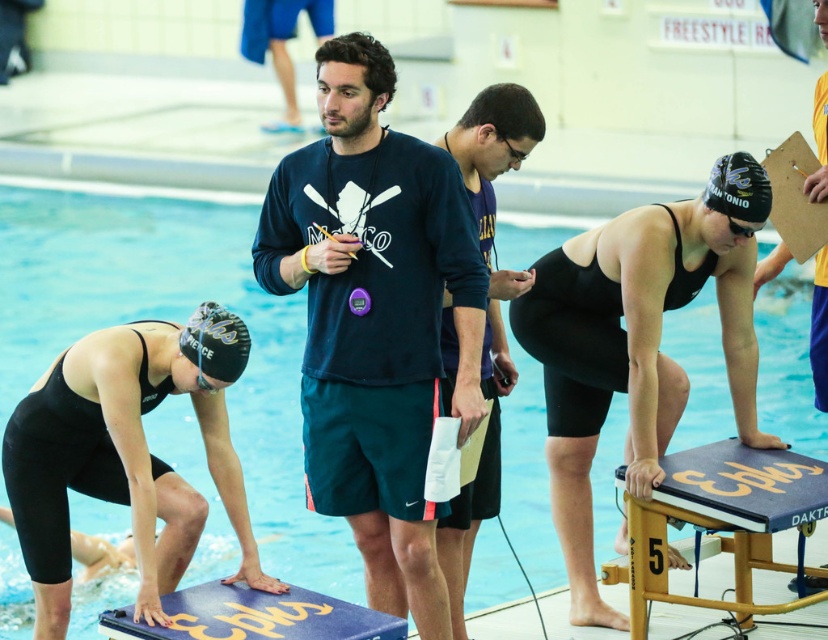
You are a lifeguard standing at the edge of the pool. You notice the blue smooth water at center and the navy blue sweatshirt at center. Which object is closer to the surface of the water?

The blue smooth water at center is positioned over the navy blue sweatshirt at center, so the blue smooth water at center is closer to the surface of the water.

You are a swimmer standing at the edge of the pool. You see the blue smooth water at center and the navy blue fabric shirt at center. Which object is taller?

The blue smooth water at center is taller than the navy blue fabric shirt at center.